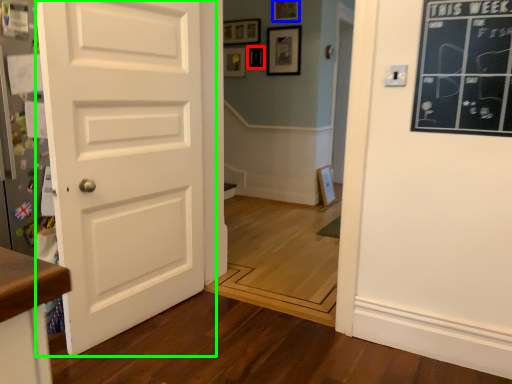
Question: Based on their relative distances, which object is nearer to picture frame (highlighted by a red box)? Choose from picture frame (highlighted by a blue box) and door (highlighted by a green box).

Choices:
 (A) picture frame
 (B) door

Answer: (A)